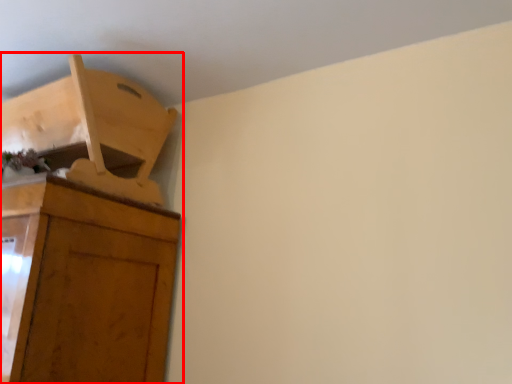
Question: Where is cupboard (annotated by the red box) located in relation to furniture in the image?

Choices:
 (A) left
 (B) right

Answer: (A)